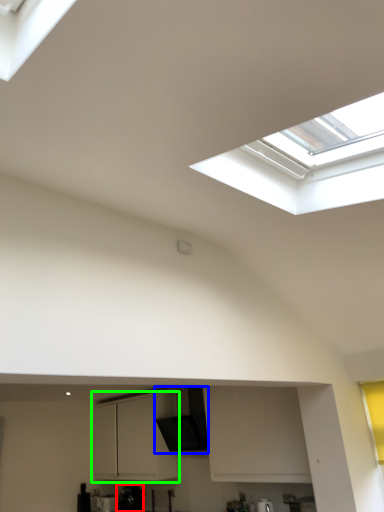
Question: Which object is the closest to the appliance (highlighted by a red box)? Choose among these: exhaust hood (highlighted by a blue box) or cabinetry (highlighted by a green box).

Choices:
 (A) exhaust hood
 (B) cabinetry

Answer: (B)